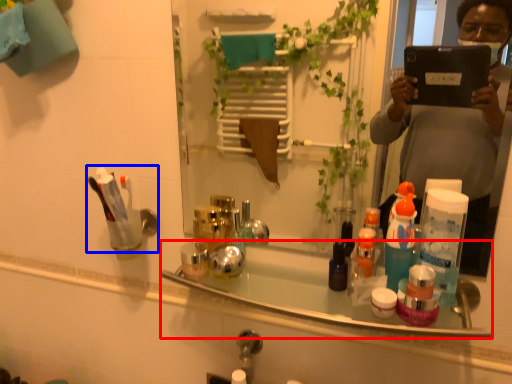
Question: Which of the following is the farthest to the observer, bath (highlighted by a red box) or toiletry (highlighted by a blue box)?

Choices:
 (A) bath
 (B) toiletry

Answer: (B)